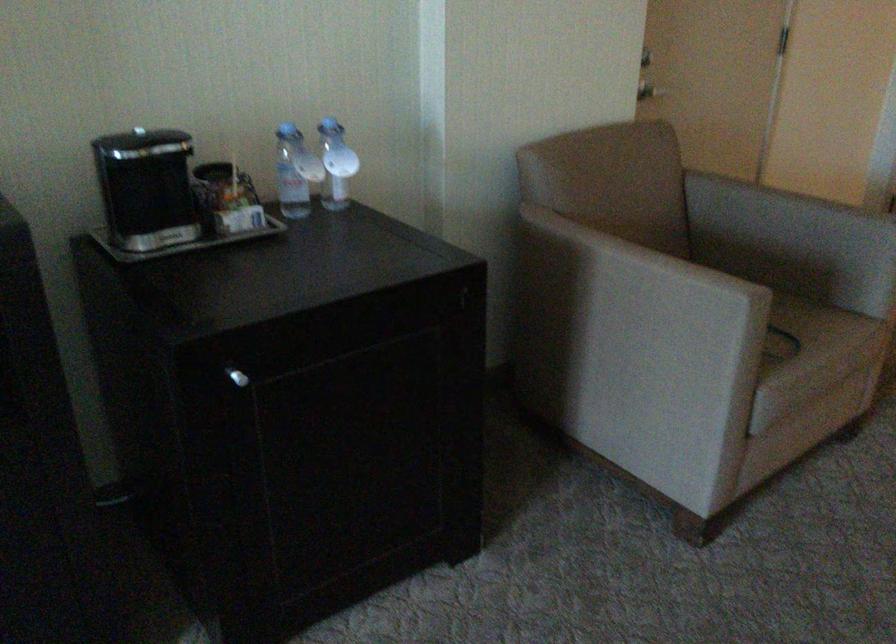
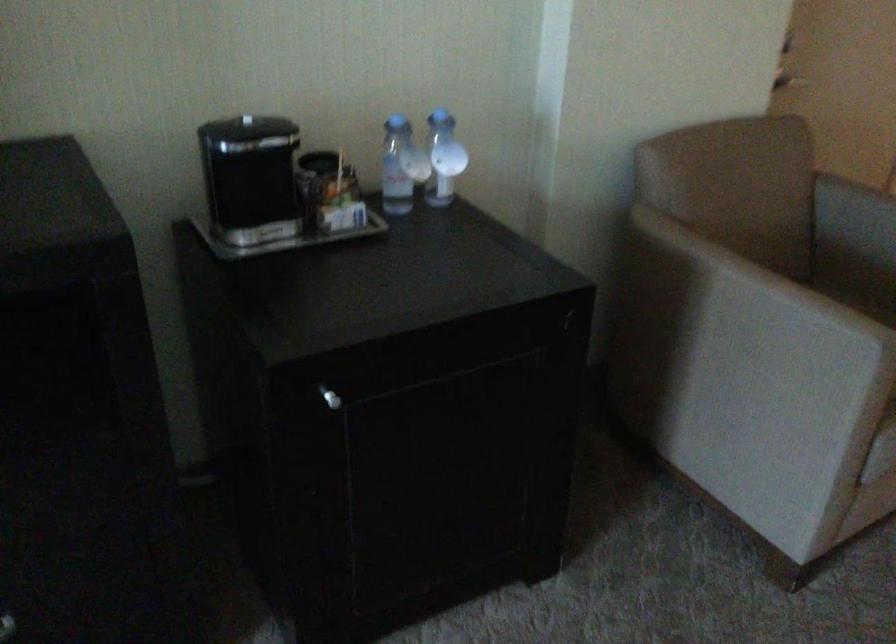
Find the pixel in the second image that matches (333,160) in the first image.

(443, 158)